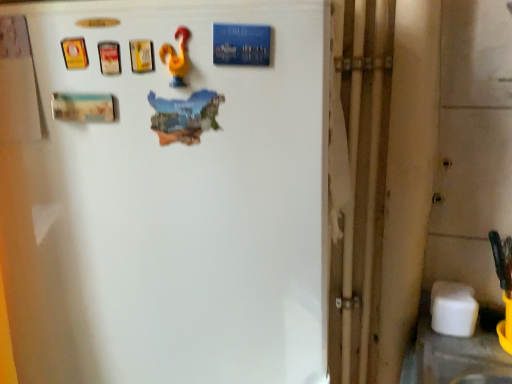
Question: From the image's perspective, is yellow rubber rooster at upper center above or below white glossy refrigerator at upper center?

Choices:
 (A) above
 (B) below

Answer: (A)

Question: From a real-world perspective, relative to white glossy refrigerator at upper center, is yellow rubber rooster at upper center vertically above or below?

Choices:
 (A) above
 (B) below

Answer: (A)

Question: Do you think yellow rubber rooster at upper center is within white glossy refrigerator at upper center, or outside of it?

Choices:
 (A) inside
 (B) outside

Answer: (A)

Question: From the image's perspective, is white glossy refrigerator at upper center positioned above or below yellow rubber rooster at upper center?

Choices:
 (A) below
 (B) above

Answer: (A)

Question: From a real-world perspective, relative to yellow rubber rooster at upper center, is white glossy refrigerator at upper center vertically above or below?

Choices:
 (A) above
 (B) below

Answer: (B)

Question: From their relative heights in the image, would you say white glossy refrigerator at upper center is taller or shorter than yellow rubber rooster at upper center?

Choices:
 (A) short
 (B) tall

Answer: (B)

Question: Is white glossy refrigerator at upper center inside or outside of yellow rubber rooster at upper center?

Choices:
 (A) inside
 (B) outside

Answer: (B)